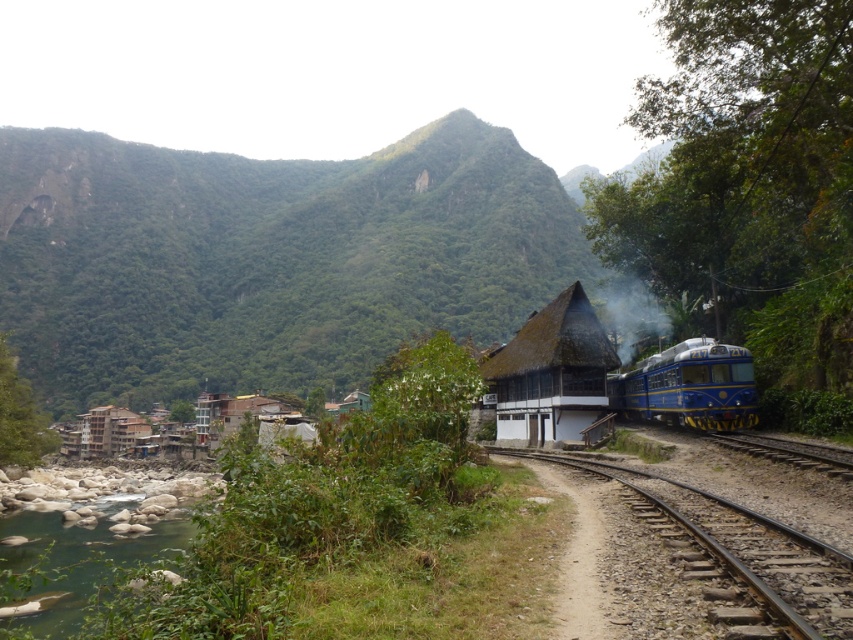
Question: In this image, where is brown gravel track at lower right located relative to clear water at river left?

Choices:
 (A) above
 (B) below

Answer: (A)

Question: Among these objects, which one is nearest to the camera?

Choices:
 (A) brown gravel track at lower right
 (B) thatched wood hut at center

Answer: (A)

Question: Is green leafy mountain at upper left below brown gravel track at lower right?

Choices:
 (A) yes
 (B) no

Answer: (B)

Question: Which point is farther to the camera?

Choices:
 (A) (328, 232)
 (B) (788, 444)
 (C) (759, 612)
 (D) (624, 333)

Answer: (A)

Question: Is blue polished metal train at right closer to the viewer compared to brown corrugated metal hut at lower left?

Choices:
 (A) no
 (B) yes

Answer: (B)

Question: Which is farther from the white smoke at center?

Choices:
 (A) blue polished metal train at right
 (B) brown gravel track at lower right
 (C) clear water at river left

Answer: (B)